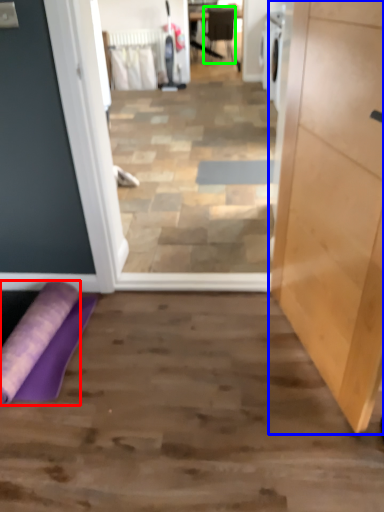
Question: Which object is positioned closest to beach towel (highlighted by a red box)? Select from cabinetry (highlighted by a blue box) and chair (highlighted by a green box).

Choices:
 (A) cabinetry
 (B) chair

Answer: (A)